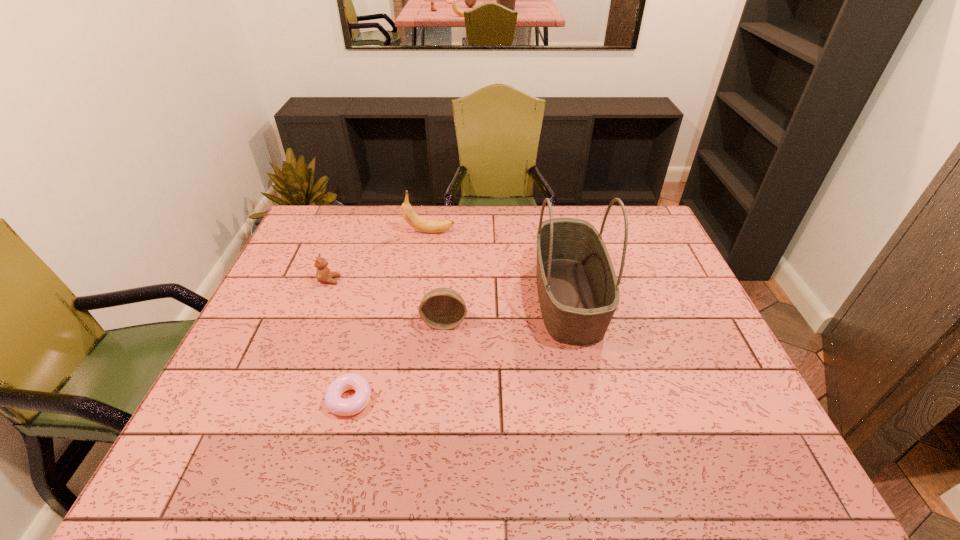
The image size is (960, 540). I want to click on free region located at the start of the peel on the fourth shortest object, so pos(468,232).

In order to click on vacant space located on the left of the bowl in this screenshot , I will do `click(343, 322)`.

The image size is (960, 540). Find the location of `vacant space located 0.130m on the face of the teddy bear`. vacant space located 0.130m on the face of the teddy bear is located at coordinates (381, 280).

I want to click on blank space located 0.230m on the left of the doughnut, so click(x=230, y=400).

Where is `object located at the far edge`? This screenshot has width=960, height=540. object located at the far edge is located at coordinates (430, 226).

The width and height of the screenshot is (960, 540). What are the coordinates of `object located in the left edge section of the desktop` in the screenshot? It's located at (323, 274).

In the image, there is a desktop. In order to click on vacant region at the far edge in this screenshot , I will do `click(354, 242)`.

Where is `free space at the near edge of the desktop`? The width and height of the screenshot is (960, 540). free space at the near edge of the desktop is located at coordinates (282, 477).

Identify the location of vacant space at the left edge of the desktop. (316, 279).

Where is `vacant space at the right edge of the desktop`? vacant space at the right edge of the desktop is located at coordinates (658, 265).